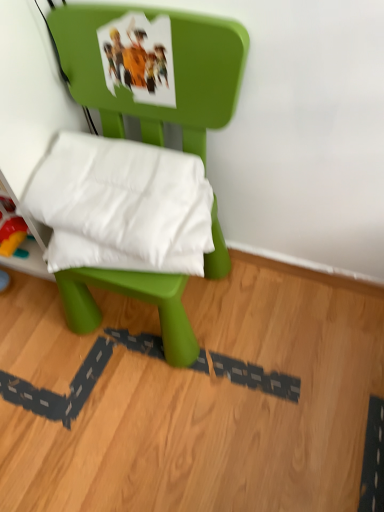
Question: Should I look upward or downward to see green plastic chair at center?

Choices:
 (A) up
 (B) down

Answer: (A)

Question: From the image's perspective, does green plastic chair at center appear lower than white soft pillow at center?

Choices:
 (A) no
 (B) yes

Answer: (B)

Question: Is green plastic chair at center to the right of white soft pillow at center from the viewer's perspective?

Choices:
 (A) no
 (B) yes

Answer: (B)

Question: From the image's perspective, is green plastic chair at center on white soft pillow at center?

Choices:
 (A) no
 (B) yes

Answer: (A)

Question: Considering the relative sizes of green plastic chair at center and white soft pillow at center in the image provided, is green plastic chair at center bigger than white soft pillow at center?

Choices:
 (A) no
 (B) yes

Answer: (B)

Question: Is green plastic chair at center oriented away from white soft pillow at center?

Choices:
 (A) yes
 (B) no

Answer: (A)

Question: Is green plastic chair at center completely or partially outside of white soft pillow at center?

Choices:
 (A) yes
 (B) no

Answer: (A)

Question: Is white soft pillow at center to the right of green plastic chair at center from the viewer's perspective?

Choices:
 (A) yes
 (B) no

Answer: (B)

Question: Is white soft pillow at center at the left side of green plastic chair at center?

Choices:
 (A) no
 (B) yes

Answer: (B)

Question: Can you confirm if white soft pillow at center is smaller than green plastic chair at center?

Choices:
 (A) yes
 (B) no

Answer: (A)

Question: Does white soft pillow at center come in front of green plastic chair at center?

Choices:
 (A) no
 (B) yes

Answer: (A)

Question: Can green plastic chair at center be found inside white soft pillow at center?

Choices:
 (A) yes
 (B) no

Answer: (B)

Question: Is white soft pillow at center looking in the opposite direction of green plastic chair at center?

Choices:
 (A) yes
 (B) no

Answer: (A)

Question: From the image's perspective, is white soft pillow at center positioned above or below green plastic chair at center?

Choices:
 (A) below
 (B) above

Answer: (B)